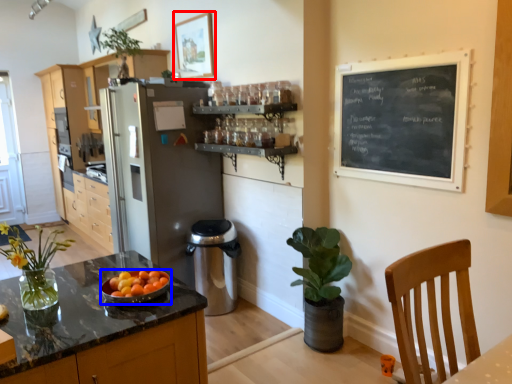
Question: Which object is further to the camera taking this photo, picture frame (highlighted by a red box) or kitchen appliance (highlighted by a blue box)?

Choices:
 (A) picture frame
 (B) kitchen appliance

Answer: (A)